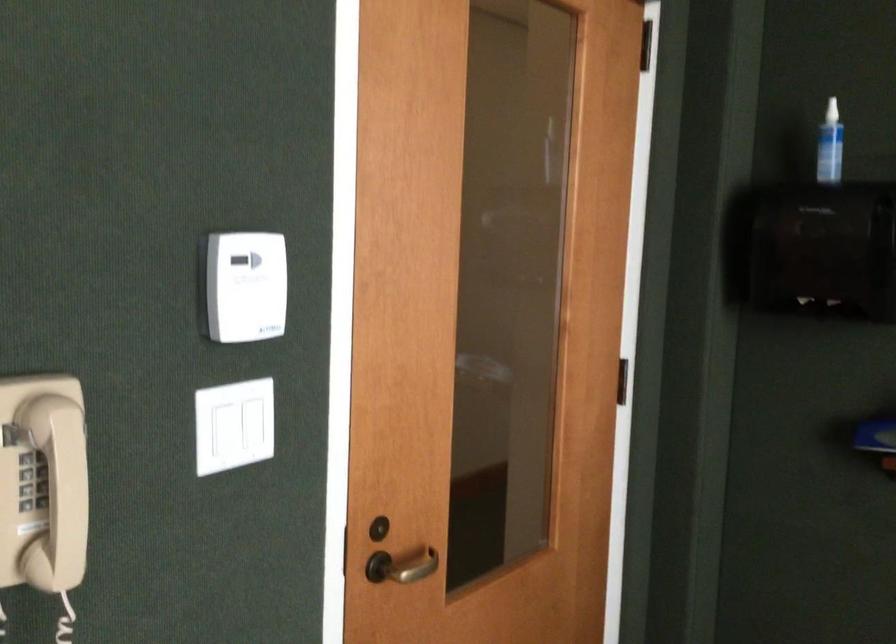
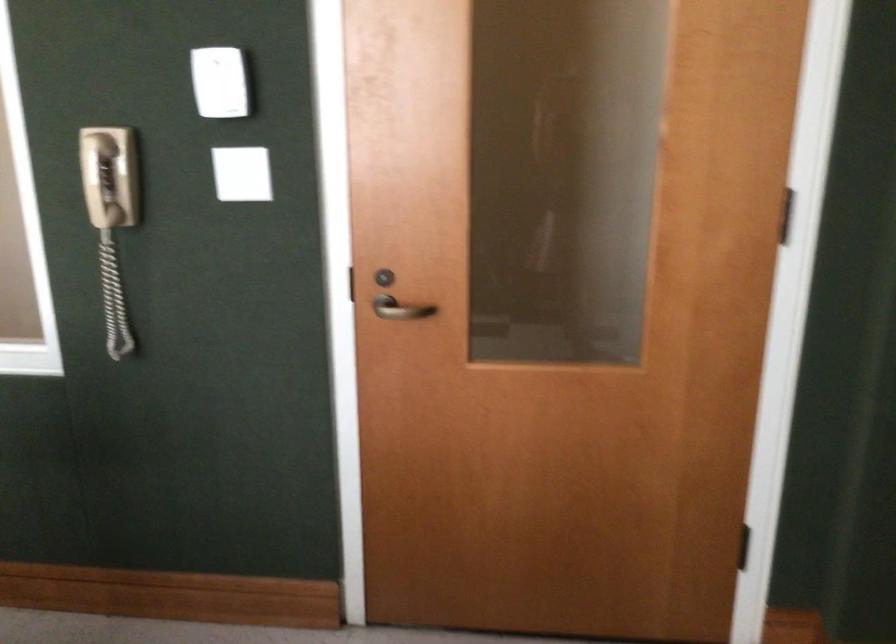
Locate, in the second image, the point that corresponds to pixel 338 547 in the first image.

(346, 283)